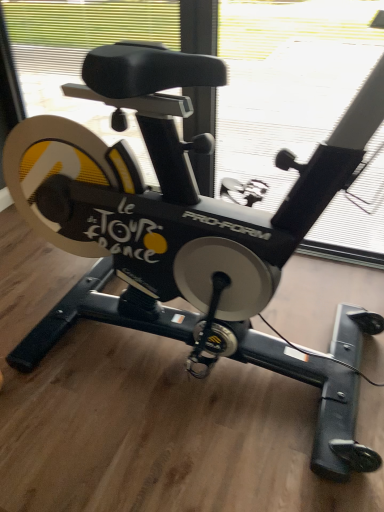
Describe the element at coordinates (287, 81) in the screenshot. This screenshot has width=384, height=512. I see `transparent plastic window screen at upper center, which ranks as the first window screen in back-to-front order` at that location.

How much space does transparent plastic window screen at upper center, the second window screen from the front, occupy horizontally?

The width of transparent plastic window screen at upper center, the second window screen from the front, is 8.99 centimeters.

This screenshot has width=384, height=512. I want to click on transparent plastic window screen at upper center, which ranks as the first window screen in back-to-front order, so click(287, 81).

What is the approximate height of transparent plastic window screen at upper center, the first window screen from the front?

transparent plastic window screen at upper center, the first window screen from the front, is 3.37 feet in height.

What do you see at coordinates (285, 81) in the screenshot?
I see `transparent plastic window screen at upper center, placed as the second window screen when sorted from back to front` at bounding box center [285, 81].

This screenshot has width=384, height=512. Find the location of `transparent plastic window screen at upper center, placed as the second window screen when sorted from back to front`. transparent plastic window screen at upper center, placed as the second window screen when sorted from back to front is located at coordinates (285, 81).

At what (x,y) coordinates should I click in order to perform the action: click on transparent plastic window screen at upper center, which ranks as the first window screen in back-to-front order. Please return your answer as a coordinate pair (x, y). The image size is (384, 512). Looking at the image, I should click on (287, 81).

Does transparent plastic window screen at upper center, placed as the second window screen when sorted from back to front, appear on the left side of transparent plastic window screen at upper center, the second window screen from the front?

Correct, you'll find transparent plastic window screen at upper center, placed as the second window screen when sorted from back to front, to the left of transparent plastic window screen at upper center, the second window screen from the front.

Is transparent plastic window screen at upper center, the first window screen from the front, in front of or behind transparent plastic window screen at upper center, the second window screen from the front, in the image?

transparent plastic window screen at upper center, the first window screen from the front, is positioned closer to the viewer than transparent plastic window screen at upper center, the second window screen from the front.

Does point (116, 26) appear closer or farther from the camera than point (300, 30)?

Point (116, 26) appears to be farther away from the viewer than point (300, 30).

In the scene shown: From the image's perspective, does transparent plastic window screen at upper center, placed as the second window screen when sorted from back to front, appear higher than transparent plastic window screen at upper center, which ranks as the first window screen in back-to-front order?

Incorrect, from the image's perspective, transparent plastic window screen at upper center, placed as the second window screen when sorted from back to front, is lower than transparent plastic window screen at upper center, which ranks as the first window screen in back-to-front order.

From a real-world perspective, who is located higher, transparent plastic window screen at upper center, the first window screen from the front, or transparent plastic window screen at upper center, the second window screen from the front?

transparent plastic window screen at upper center, the first window screen from the front, is physically above.

Considering the relative sizes of transparent plastic window screen at upper center, the first window screen from the front, and transparent plastic window screen at upper center, which ranks as the first window screen in back-to-front order, in the image provided, is transparent plastic window screen at upper center, the first window screen from the front, thinner than transparent plastic window screen at upper center, which ranks as the first window screen in back-to-front order,?

Incorrect, the width of transparent plastic window screen at upper center, the first window screen from the front, is not less than that of transparent plastic window screen at upper center, which ranks as the first window screen in back-to-front order.

Can you confirm if transparent plastic window screen at upper center, the first window screen from the front, is taller than transparent plastic window screen at upper center, which ranks as the first window screen in back-to-front order?

Correct, transparent plastic window screen at upper center, the first window screen from the front, is much taller as transparent plastic window screen at upper center, which ranks as the first window screen in back-to-front order.

Considering the relative sizes of transparent plastic window screen at upper center, placed as the second window screen when sorted from back to front, and transparent plastic window screen at upper center, the second window screen from the front, in the image provided, is transparent plastic window screen at upper center, placed as the second window screen when sorted from back to front, smaller than transparent plastic window screen at upper center, the second window screen from the front,?

Incorrect, transparent plastic window screen at upper center, placed as the second window screen when sorted from back to front, is not smaller in size than transparent plastic window screen at upper center, the second window screen from the front.

Is transparent plastic window screen at upper center, the first window screen from the front, completely or partially outside of transparent plastic window screen at upper center, which ranks as the first window screen in back-to-front order?

transparent plastic window screen at upper center, the first window screen from the front, is positioned outside transparent plastic window screen at upper center, which ranks as the first window screen in back-to-front order.

Is there a large distance between transparent plastic window screen at upper center, the first window screen from the front, and transparent plastic window screen at upper center, which ranks as the first window screen in back-to-front order?

They are positioned close to each other.

Does transparent plastic window screen at upper center, the first window screen from the front, turn towards transparent plastic window screen at upper center, the second window screen from the front?

No, transparent plastic window screen at upper center, the first window screen from the front, is not facing towards transparent plastic window screen at upper center, the second window screen from the front.

How many degrees apart are the facing directions of transparent plastic window screen at upper center, the first window screen from the front, and transparent plastic window screen at upper center, which ranks as the first window screen in back-to-front order?

The facing directions of transparent plastic window screen at upper center, the first window screen from the front, and transparent plastic window screen at upper center, which ranks as the first window screen in back-to-front order, are 0.00783 degrees apart.

Looking at this image, how much distance is there between transparent plastic window screen at upper center, placed as the second window screen when sorted from back to front, and transparent plastic window screen at upper center, the second window screen from the front?

They are 5.40 inches apart.

This screenshot has height=512, width=384. I want to click on window screen located on the right of transparent plastic window screen at upper center, the first window screen from the front, so click(287, 81).

Considering the positions of objects transparent plastic window screen at upper center, the second window screen from the front, and transparent plastic window screen at upper center, the first window screen from the front, in the image provided, who is more to the left, transparent plastic window screen at upper center, the second window screen from the front, or transparent plastic window screen at upper center, the first window screen from the front,?

From the viewer's perspective, transparent plastic window screen at upper center, the first window screen from the front, appears more on the left side.

Is the position of transparent plastic window screen at upper center, which ranks as the first window screen in back-to-front order, more distant than that of transparent plastic window screen at upper center, placed as the second window screen when sorted from back to front?

Yes, it is behind transparent plastic window screen at upper center, placed as the second window screen when sorted from back to front.

Is point (372, 165) positioned behind point (33, 111)?

No, (372, 165) is closer to viewer.

From the image's perspective, between transparent plastic window screen at upper center, the second window screen from the front, and transparent plastic window screen at upper center, placed as the second window screen when sorted from back to front, who is located below?

From the image's view, transparent plastic window screen at upper center, placed as the second window screen when sorted from back to front, is below.

From a real-world perspective, is transparent plastic window screen at upper center, which ranks as the first window screen in back-to-front order, positioned over transparent plastic window screen at upper center, placed as the second window screen when sorted from back to front, based on gravity?

No, from a real-world perspective, transparent plastic window screen at upper center, which ranks as the first window screen in back-to-front order, is not above transparent plastic window screen at upper center, placed as the second window screen when sorted from back to front.

Considering the relative sizes of transparent plastic window screen at upper center, the second window screen from the front, and transparent plastic window screen at upper center, placed as the second window screen when sorted from back to front, in the image provided, is transparent plastic window screen at upper center, the second window screen from the front, thinner than transparent plastic window screen at upper center, placed as the second window screen when sorted from back to front,?

Yes, transparent plastic window screen at upper center, the second window screen from the front, is thinner than transparent plastic window screen at upper center, placed as the second window screen when sorted from back to front.

Considering the relative sizes of transparent plastic window screen at upper center, which ranks as the first window screen in back-to-front order, and transparent plastic window screen at upper center, placed as the second window screen when sorted from back to front, in the image provided, is transparent plastic window screen at upper center, which ranks as the first window screen in back-to-front order, taller than transparent plastic window screen at upper center, placed as the second window screen when sorted from back to front,?

In fact, transparent plastic window screen at upper center, which ranks as the first window screen in back-to-front order, may be shorter than transparent plastic window screen at upper center, placed as the second window screen when sorted from back to front.

Does transparent plastic window screen at upper center, the second window screen from the front, have a larger size compared to transparent plastic window screen at upper center, the first window screen from the front?

No.

Looking at this image, is transparent plastic window screen at upper center, the second window screen from the front, outside of transparent plastic window screen at upper center, placed as the second window screen when sorted from back to front?

Yes, transparent plastic window screen at upper center, the second window screen from the front, is not within transparent plastic window screen at upper center, placed as the second window screen when sorted from back to front.

Is transparent plastic window screen at upper center, the second window screen from the front, with transparent plastic window screen at upper center, the first window screen from the front?

No, transparent plastic window screen at upper center, the second window screen from the front, is not touching transparent plastic window screen at upper center, the first window screen from the front.

Could you tell me if transparent plastic window screen at upper center, the second window screen from the front, is turned towards transparent plastic window screen at upper center, the first window screen from the front?

→ Yes, transparent plastic window screen at upper center, the second window screen from the front, is facing transparent plastic window screen at upper center, the first window screen from the front.

How far apart are transparent plastic window screen at upper center, which ranks as the first window screen in back-to-front order, and transparent plastic window screen at upper center, the first window screen from the front?

The distance of transparent plastic window screen at upper center, which ranks as the first window screen in back-to-front order, from transparent plastic window screen at upper center, the first window screen from the front, is 13.71 centimeters.

This screenshot has width=384, height=512. What are the coordinates of `window screen that is behind the transparent plastic window screen at upper center, the first window screen from the front` in the screenshot? It's located at (287, 81).

Where is `window screen on the right of transparent plastic window screen at upper center, the first window screen from the front`? window screen on the right of transparent plastic window screen at upper center, the first window screen from the front is located at coordinates (287, 81).

Locate an element on the screen. window screen that appears below the transparent plastic window screen at upper center, placed as the second window screen when sorted from back to front (from a real-world perspective) is located at coordinates (287, 81).